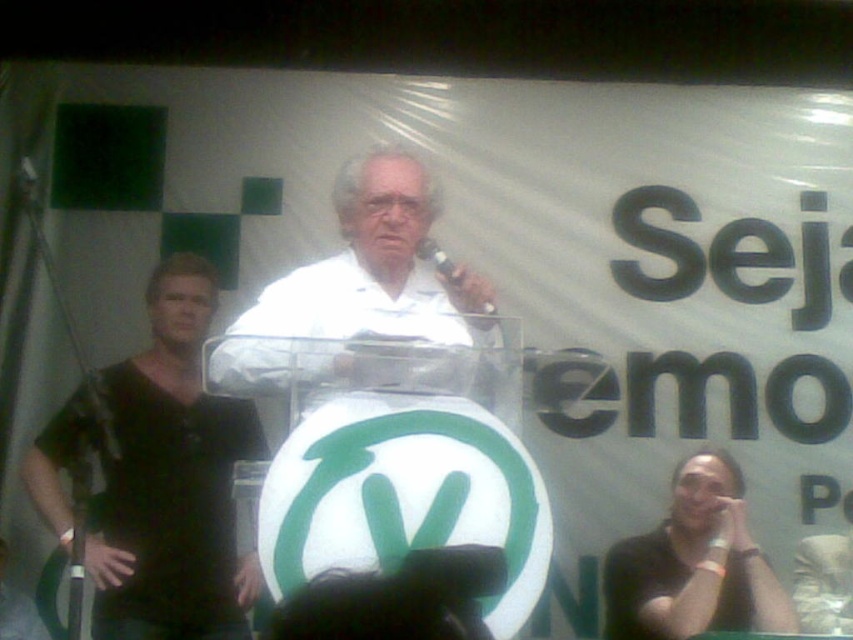
Looking at this image, who is taller, black matte shirt at left or black plastic microphone at center?

With more height is black matte shirt at left.

Who is shorter, black matte shirt at left or black plastic microphone at center?

black plastic microphone at center

Which is behind, point (99, 632) or point (430, 246)?

Point (99, 632)

Image resolution: width=853 pixels, height=640 pixels. What are the coordinates of `black matte shirt at left` in the screenshot? It's located at (172, 480).

Can you confirm if black matte shirt at lower right is positioned above black plastic microphone at center?

Actually, black matte shirt at lower right is below black plastic microphone at center.

Does point (724, 536) come behind point (450, 262)?

Yes, it is.

Find the location of `black matte shirt at lower right`. black matte shirt at lower right is located at coordinates (694, 564).

Is white matte shirt at center thinner than black plastic microphone at center?

In fact, white matte shirt at center might be wider than black plastic microphone at center.

Who is positioned more to the left, white matte shirt at center or black plastic microphone at center?

Positioned to the left is white matte shirt at center.

At what (x,y) coordinates should I click in order to perform the action: click on white matte shirt at center. Please return your answer as a coordinate pair (x, y). Looking at the image, I should click on (357, 288).

What are the coordinates of `white matte shirt at center` in the screenshot? It's located at (357, 288).